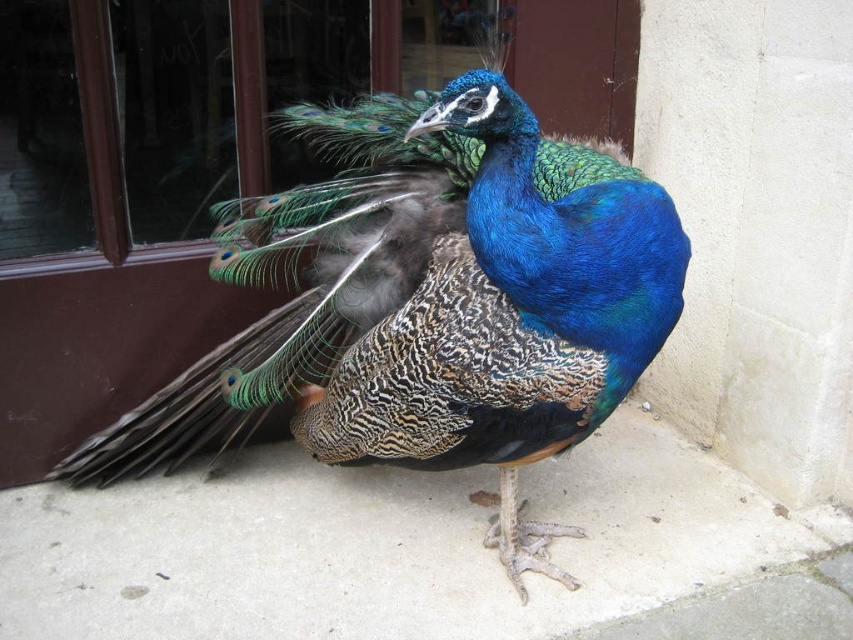
Question: From the image, what is the correct spatial relationship of shiny blue peacock at center in relation to smooth concrete pavement at lower center?

Choices:
 (A) left
 (B) right

Answer: (A)

Question: Which point is closer to the camera?

Choices:
 (A) shiny blue peacock at center
 (B) smooth concrete pavement at lower center

Answer: (A)

Question: Which object appears closest to the camera in this image?

Choices:
 (A) shiny blue peacock at center
 (B) smooth concrete pavement at lower center

Answer: (A)

Question: Can you confirm if shiny blue peacock at center is positioned below smooth concrete pavement at lower center?

Choices:
 (A) yes
 (B) no

Answer: (B)

Question: Can you confirm if shiny blue peacock at center is positioned above smooth concrete pavement at lower center?

Choices:
 (A) yes
 (B) no

Answer: (A)

Question: Which of the following is the closest to the observer?

Choices:
 (A) (460, 353)
 (B) (202, 580)

Answer: (A)